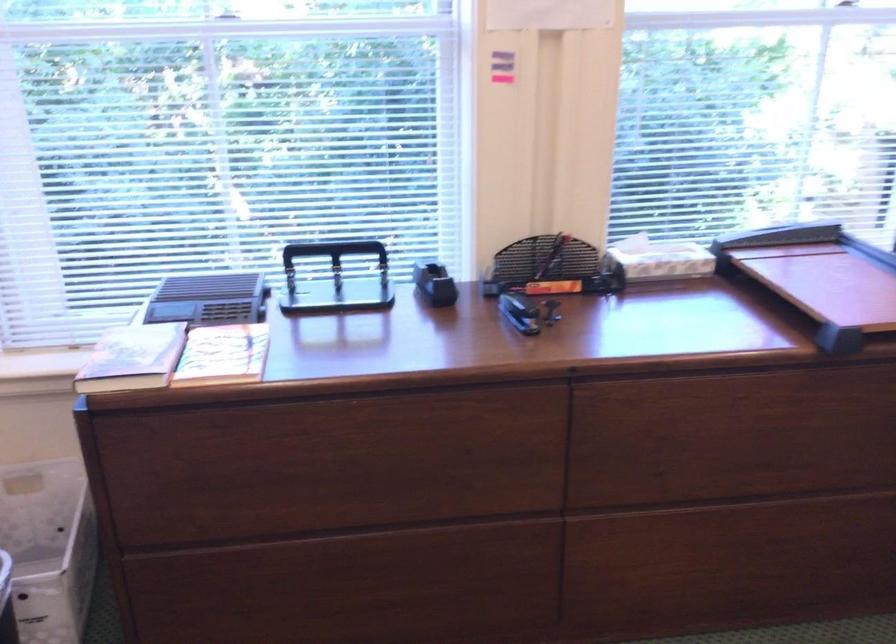
Question: The camera is either moving clockwise (left) or counter-clockwise (right) around the object. The first image is from the beginning of the video and the second image is from the end. Is the camera moving left or right when shooting the video?

Choices:
 (A) Left
 (B) Right

Answer: (A)